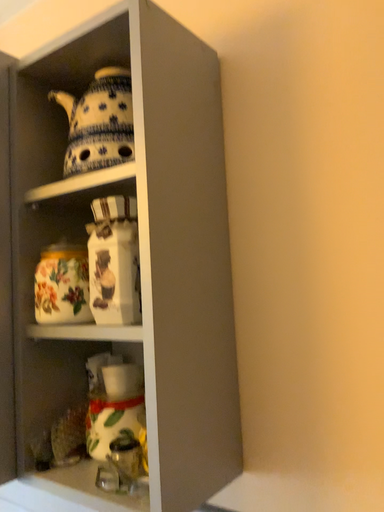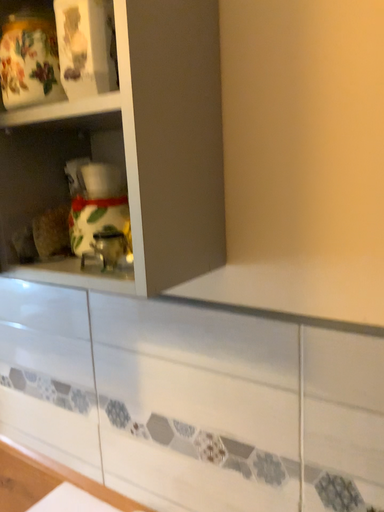
Question: How did the camera likely rotate when shooting the video?

Choices:
 (A) rotated downward
 (B) rotated upward

Answer: (A)